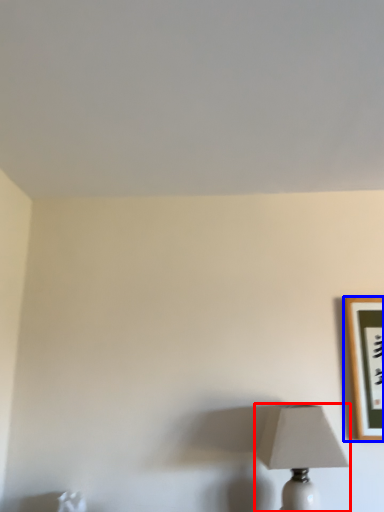
Question: Which object is further to the camera taking this photo, lamp (highlighted by a red box) or picture frame (highlighted by a blue box)?

Choices:
 (A) lamp
 (B) picture frame

Answer: (B)